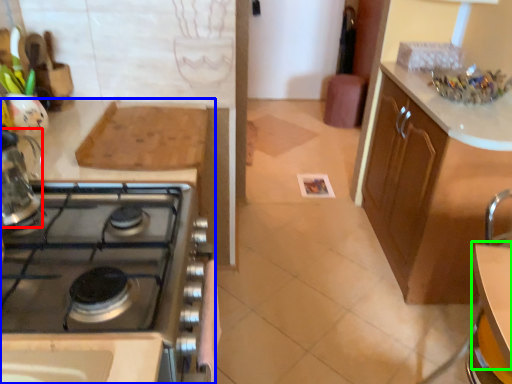
Question: Considering the real-world distances, which object is closest to kitchen appliance (highlighted by a red box)? cabinetry (highlighted by a blue box) or table (highlighted by a green box).

Choices:
 (A) cabinetry
 (B) table

Answer: (A)